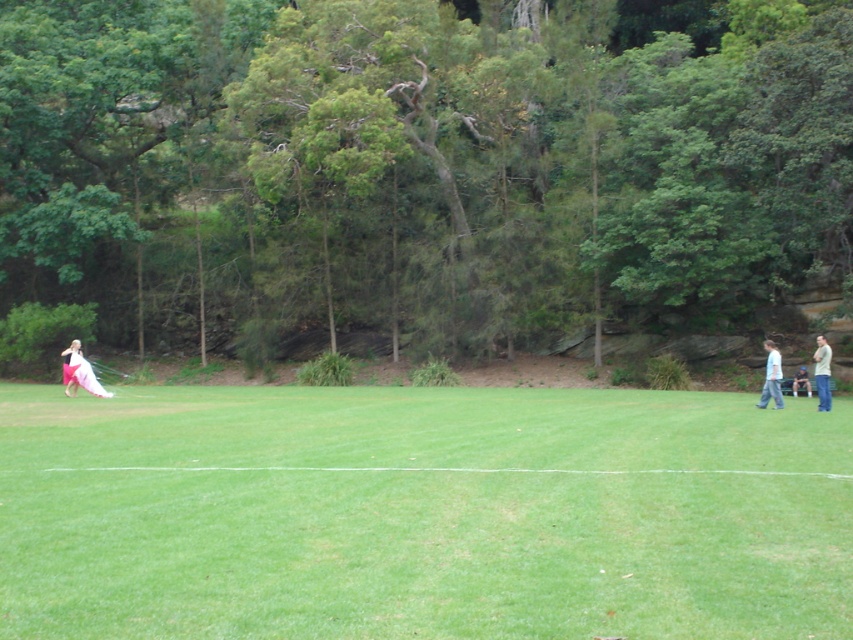
You are a photographer positioned in the center of the field. You want to take a photo that includes both the matte pink dress at left and the light brown casual shirt at right. Which subject should you focus on first to ensure both are in sharp focus?

The matte pink dress at left is closer to you than the light brown casual shirt at right. To ensure both are in focus, you should focus on the matte pink dress at left first, as focusing on the closer subject will help the camera adjust the depth of field to include the farther one.